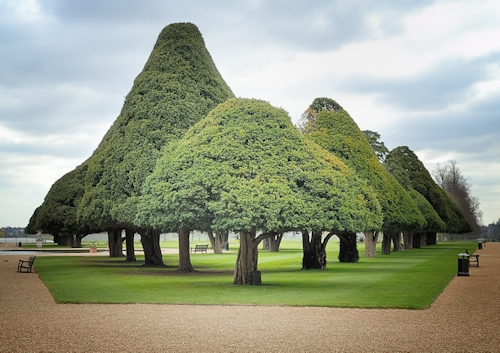
The width and height of the screenshot is (500, 353). What are the coordinates of `canopy` in the screenshot? It's located at (177, 29), (252, 107), (332, 112), (403, 154).